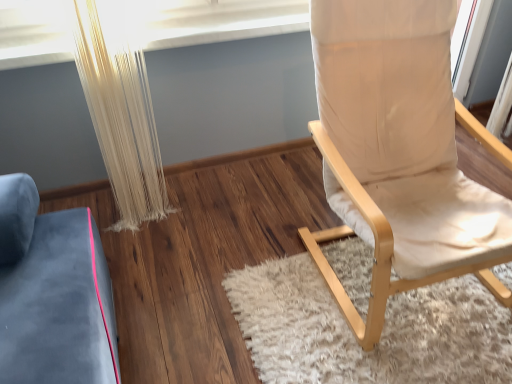
Question: Is white shaggy rug at center looking in the opposite direction of beige fabric chair at right?

Choices:
 (A) yes
 (B) no

Answer: (B)

Question: Is the position of white shaggy rug at center more distant than that of beige fabric chair at right?

Choices:
 (A) no
 (B) yes

Answer: (B)

Question: Is white shaggy rug at center positioned before beige fabric chair at right?

Choices:
 (A) yes
 (B) no

Answer: (B)

Question: Is white shaggy rug at center touching beige fabric chair at right?

Choices:
 (A) yes
 (B) no

Answer: (B)

Question: Is white shaggy rug at center positioned beyond the bounds of beige fabric chair at right?

Choices:
 (A) no
 (B) yes

Answer: (B)

Question: Is white shaggy rug at center to the left of beige fabric chair at right from the viewer's perspective?

Choices:
 (A) yes
 (B) no

Answer: (A)

Question: Is white textured curtain at left inside beige fabric chair at right?

Choices:
 (A) yes
 (B) no

Answer: (B)

Question: Can you confirm if beige fabric chair at right is bigger than white textured curtain at left?

Choices:
 (A) no
 (B) yes

Answer: (B)

Question: Does beige fabric chair at right lie behind white textured curtain at left?

Choices:
 (A) no
 (B) yes

Answer: (A)

Question: Is beige fabric chair at right with white textured curtain at left?

Choices:
 (A) yes
 (B) no

Answer: (B)

Question: Can you confirm if beige fabric chair at right is thinner than white textured curtain at left?

Choices:
 (A) no
 (B) yes

Answer: (A)

Question: Considering the relative sizes of beige fabric chair at right and white textured curtain at left in the image provided, is beige fabric chair at right shorter than white textured curtain at left?

Choices:
 (A) yes
 (B) no

Answer: (B)

Question: Is white textured curtain at left surrounded by white shaggy rug at center?

Choices:
 (A) no
 (B) yes

Answer: (A)